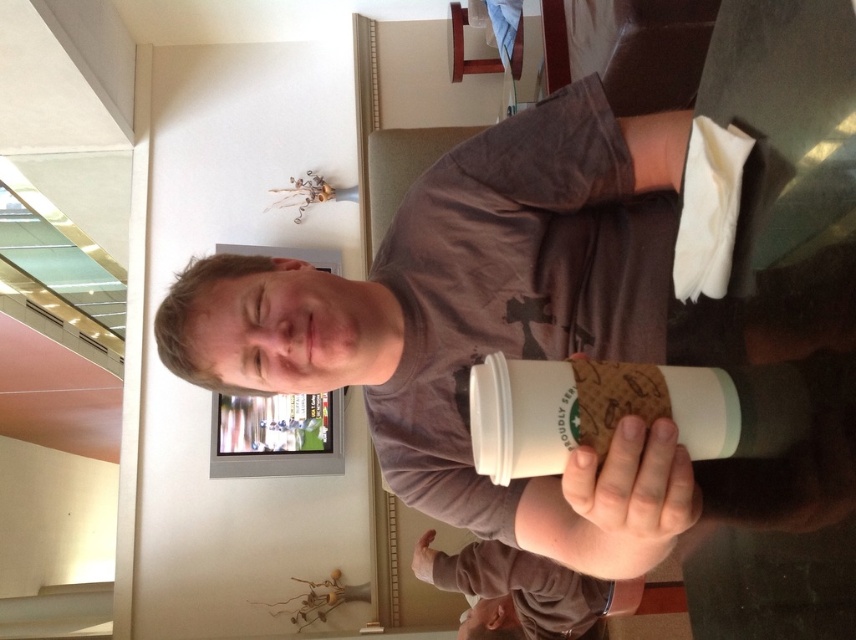
Question: Among these points, which one is farthest from the camera?

Choices:
 (A) (595, 150)
 (B) (605, 595)
 (C) (420, 554)
 (D) (616, 486)

Answer: (C)

Question: Does matte brown cup at center appear on the right side of brown matte t-shirt at lower center?

Choices:
 (A) yes
 (B) no

Answer: (B)

Question: Which object is positioned farthest from the white matte hand at center?

Choices:
 (A) white paper cup at center
 (B) brown matte t-shirt at lower center

Answer: (A)

Question: Is white paper cup at center further to camera compared to matte brown cup at center?

Choices:
 (A) yes
 (B) no

Answer: (B)

Question: Considering the real-world distances, which object is farthest from the white paper cup at center?

Choices:
 (A) white matte hand at center
 (B) brown matte t-shirt at lower center
 (C) matte brown cup at center

Answer: (A)

Question: Is white paper cup at center above brown matte t-shirt at lower center?

Choices:
 (A) yes
 (B) no

Answer: (A)